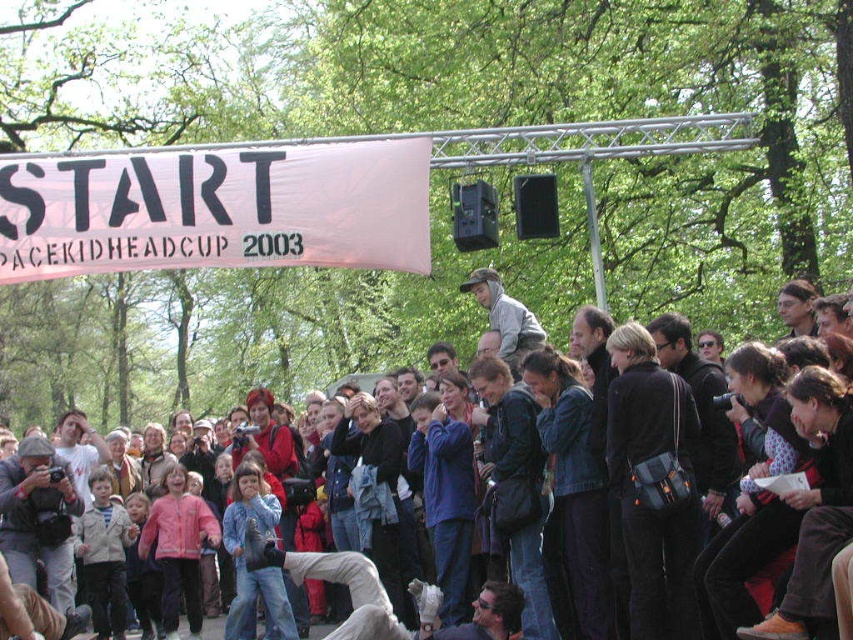
Between gray hoodie at center and matte black jacket at center, which one appears on the right side from the viewer's perspective?

matte black jacket at center

What do you see at coordinates (505, 316) in the screenshot?
I see `gray hoodie at center` at bounding box center [505, 316].

Between point (473, 282) and point (808, 292), which one is positioned behind?

The point (473, 282) is more distant.

Image resolution: width=853 pixels, height=640 pixels. I want to click on gray hoodie at center, so click(x=505, y=316).

Which is in front, point (38, 563) or point (810, 291)?

Point (810, 291) is more forward.

Who is more distant from viewer, (18, 456) or (804, 298)?

Point (18, 456)

Locate an element on the screen. This screenshot has height=640, width=853. gray fabric jacket at lower left is located at coordinates (39, 518).

Is white fabric banner at upper center above matte black jacket at center?

Yes, white fabric banner at upper center is above matte black jacket at center.

Consider the image. Can you confirm if white fabric banner at upper center is positioned to the left of matte black jacket at center?

Correct, you'll find white fabric banner at upper center to the left of matte black jacket at center.

Who is more forward, (346, 262) or (798, 296)?

Point (346, 262) is in front.

I want to click on white fabric banner at upper center, so click(216, 208).